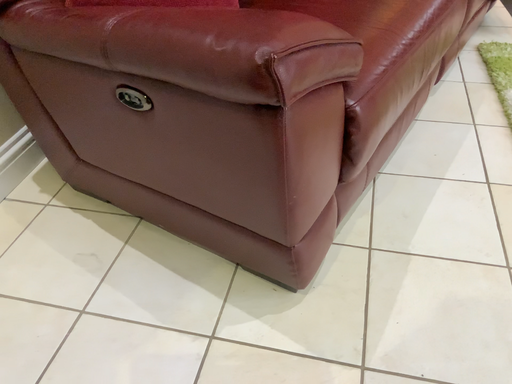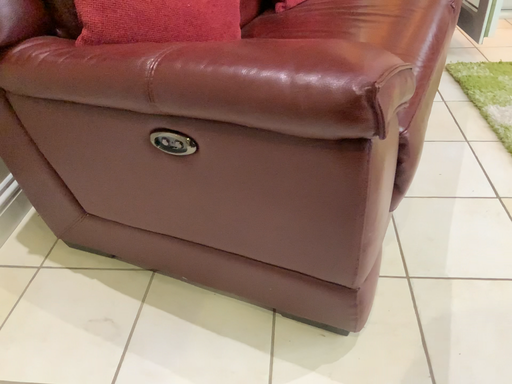
Question: How did the camera likely rotate when shooting the video?

Choices:
 (A) rotated left
 (B) rotated right

Answer: (B)